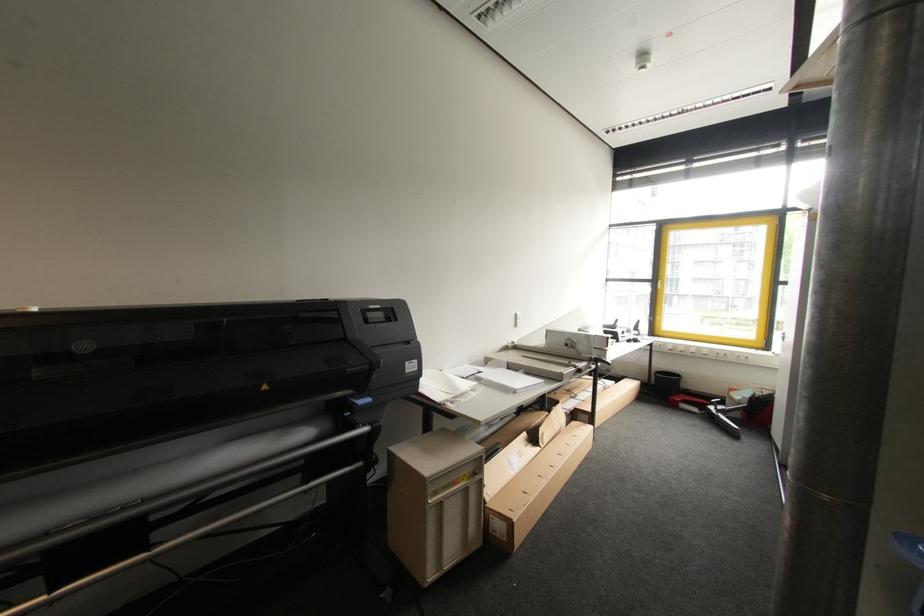
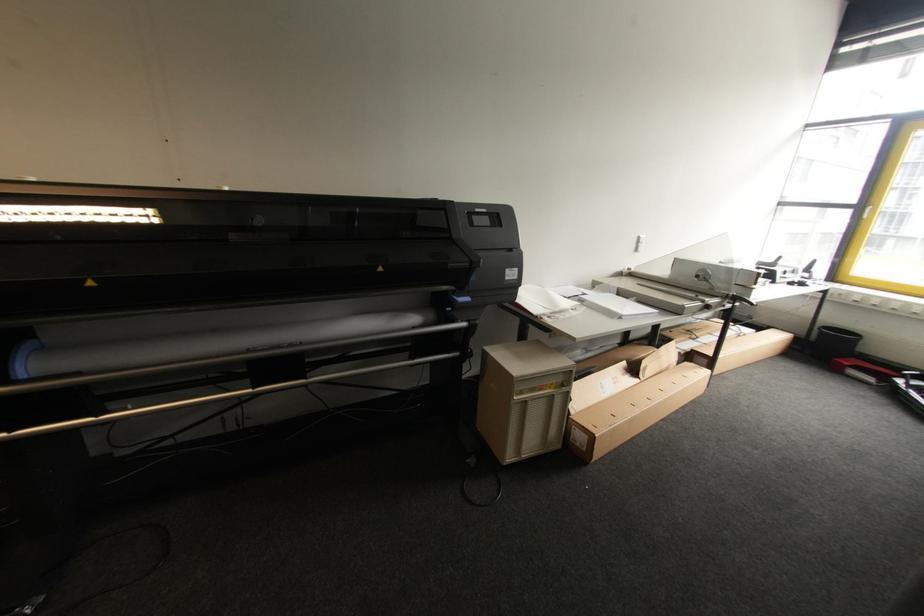
Question: How did the camera likely rotate?

Choices:
 (A) Left
 (B) Right
 (C) Up
 (D) Down

Answer: (A)